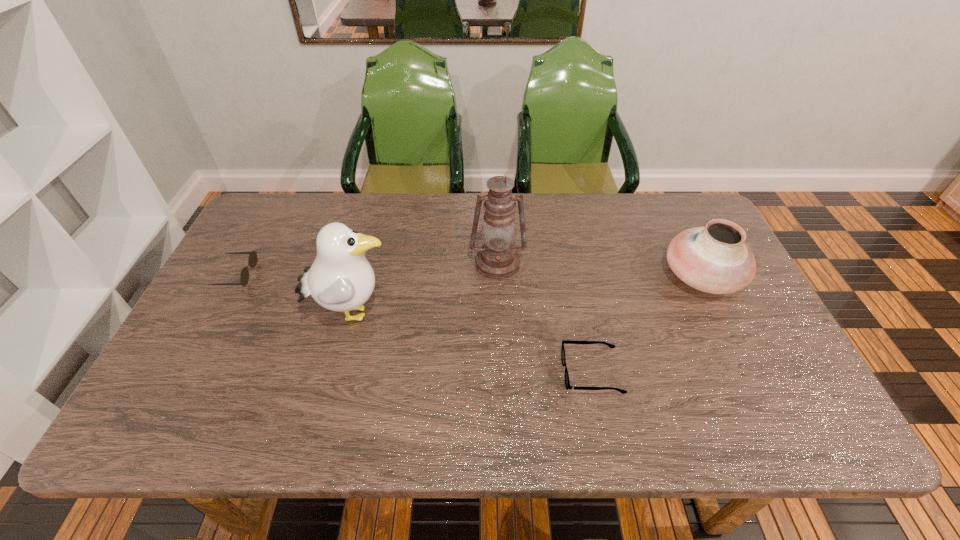
Where is `the third object from right to left`? The height and width of the screenshot is (540, 960). the third object from right to left is located at coordinates (497, 258).

Locate an element on the screen. The image size is (960, 540). gull is located at coordinates (341, 279).

The image size is (960, 540). I want to click on pottery, so click(x=714, y=258).

Where is `the rightmost object`? the rightmost object is located at coordinates (714, 258).

The width and height of the screenshot is (960, 540). Find the location of `the leftmost object`. the leftmost object is located at coordinates (244, 277).

Identify the location of spectacles. (567, 383).

The height and width of the screenshot is (540, 960). Identify the location of the fourth object from left to right. (567, 383).

Find the location of a particular element. The width and height of the screenshot is (960, 540). free space located 0.270m on the front of the third object from left to right is located at coordinates (501, 360).

You are a GUI agent. You are given a task and a screenshot of the screen. Output one action in this format:
    pyautogui.click(x=<x>, y=<y>)
    Task: Click on the free space located 0.050m on the beak of the fourth object from right to left
    Image resolution: width=960 pixels, height=540 pixels.
    Given the screenshot: What is the action you would take?
    pyautogui.click(x=414, y=313)

Locate an element on the screen. vacant space located 0.170m on the left of the third shortest object is located at coordinates (604, 276).